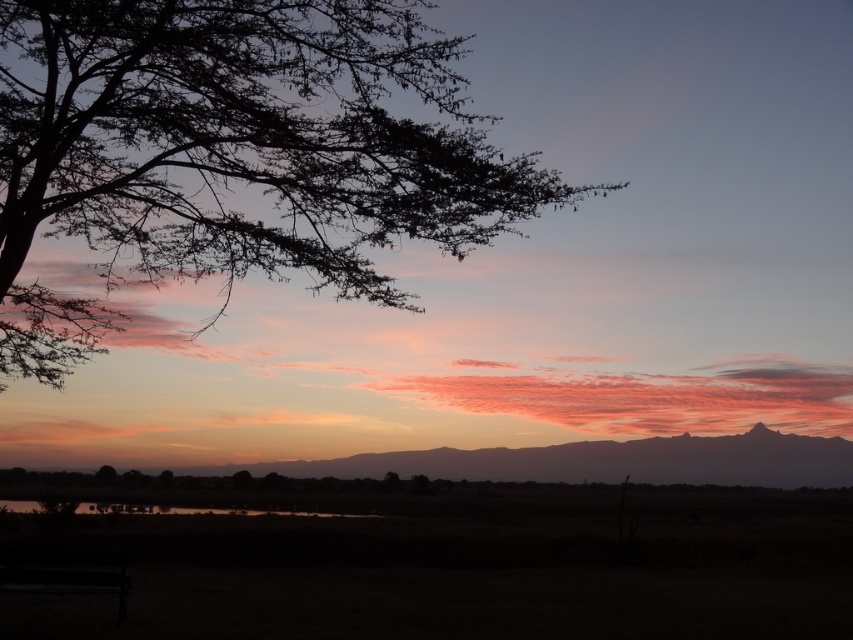
Between point (334, 188) and point (115, 512), which one is positioned behind?

Positioned behind is point (115, 512).

Is silhouette leafy tree at upper left wider than smooth water at lower center?

Yes.

What do you see at coordinates (234, 152) in the screenshot?
I see `silhouette leafy tree at upper left` at bounding box center [234, 152].

Image resolution: width=853 pixels, height=640 pixels. What are the coordinates of `silhouette leafy tree at upper left` in the screenshot? It's located at (234, 152).

Which is above, silky purple sky at center or smooth water at lower center?

silky purple sky at center is higher up.

Based on the photo, which is below, silky purple sky at center or smooth water at lower center?

smooth water at lower center

Is point (775, 448) more distant than point (93, 512)?

Yes, it is.

At what (x,y) coordinates should I click in order to perform the action: click on silky purple sky at center. Please return your answer as a coordinate pair (x, y). The height and width of the screenshot is (640, 853). Looking at the image, I should click on (601, 461).

Can you confirm if silhouette leafy tree at upper left is positioned above silky purple sky at center?

Correct, silhouette leafy tree at upper left is located above silky purple sky at center.

Can you confirm if silhouette leafy tree at upper left is shorter than silky purple sky at center?

No, silhouette leafy tree at upper left is not shorter than silky purple sky at center.

What are the coordinates of `silhouette leafy tree at upper left` in the screenshot? It's located at (234, 152).